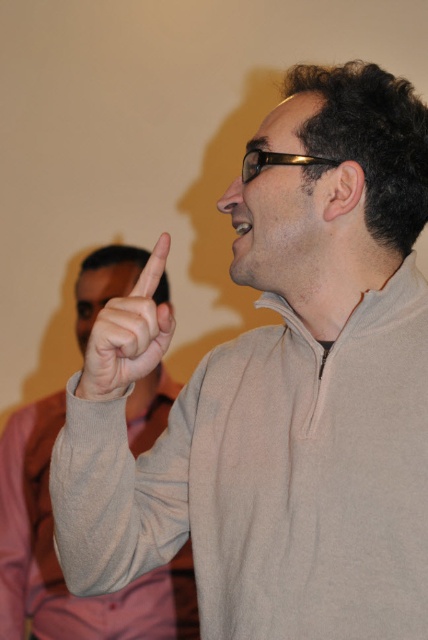
Based on the photo, between gray wool sweater at upper center and matte gray finger at upper center, which one has less height?

Standing shorter between the two is matte gray finger at upper center.

Between gray wool sweater at upper center and matte gray finger at upper center, which one appears on the right side from the viewer's perspective?

From the viewer's perspective, matte gray finger at upper center appears more on the right side.

Is point (0, 440) in front of point (119, 355)?

No, it is behind (119, 355).

The height and width of the screenshot is (640, 428). Identify the location of gray wool sweater at upper center. (56, 556).